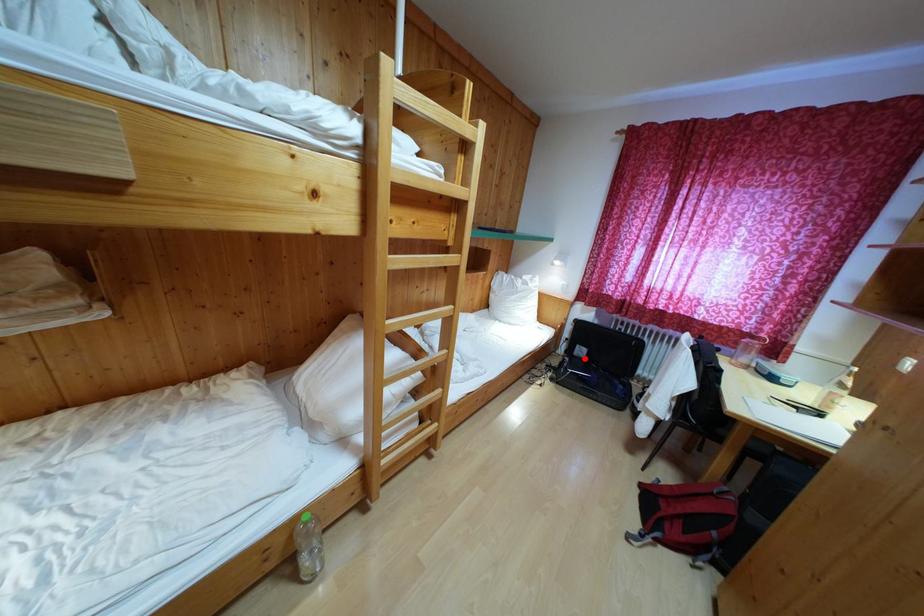
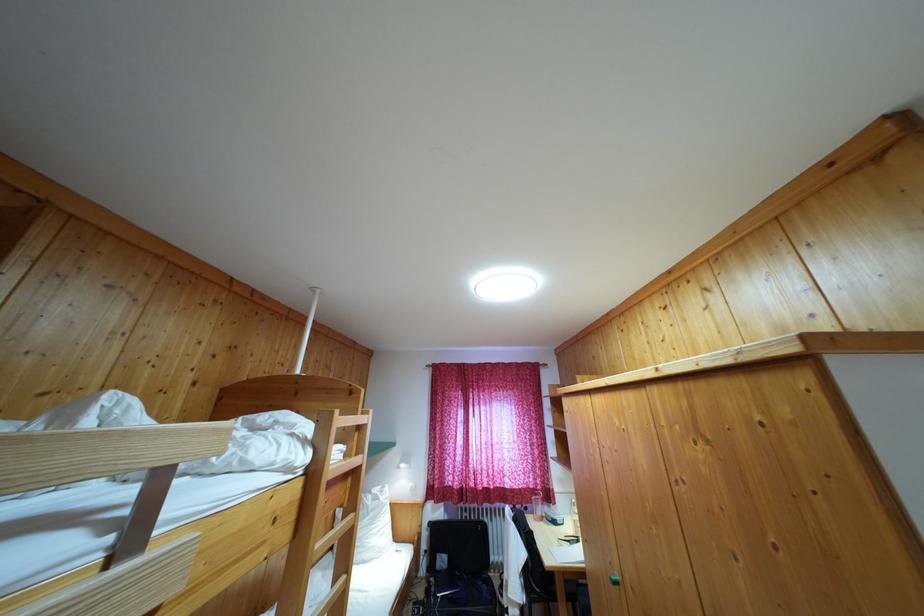
Question: I am providing you with two images of the same scene from different viewpoints. A red point is shown in image1. For the corresponding object point in image2, is it positioned nearer or farther from the camera?

Choices:
 (A) Nearer
 (B) Farther

Answer: (B)